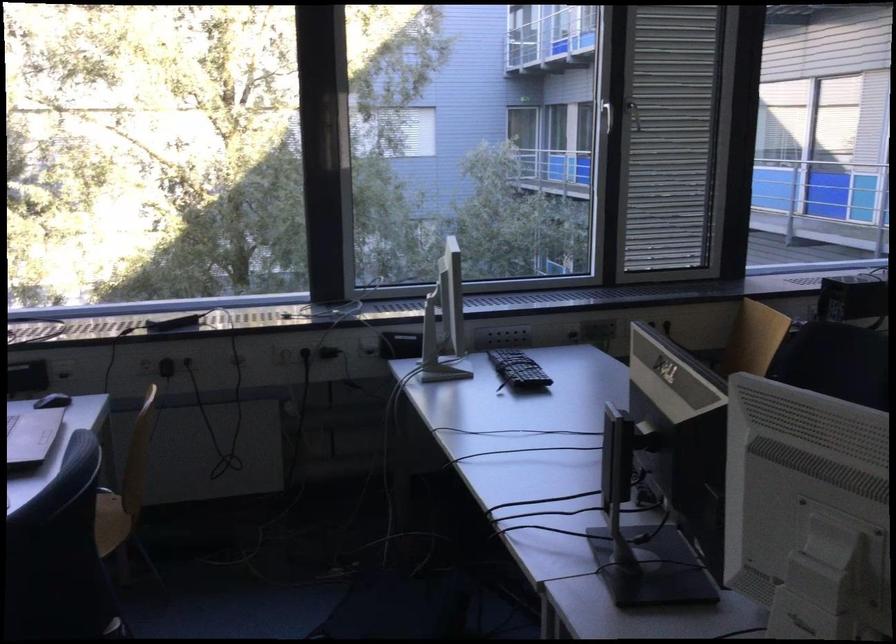
Find where to push the computer mouse. Please return your answer as a coordinate pair (x, y).

(53, 401)